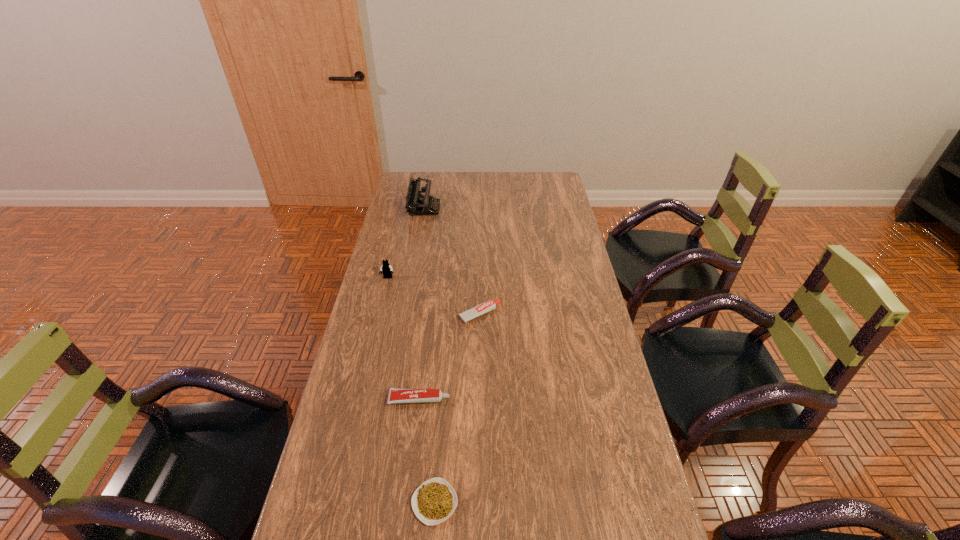
At what (x,y) coordinates should I click in order to perform the action: click on free space located on the typing side of the typewriter. Please return your answer as a coordinate pair (x, y). The image size is (960, 540). Looking at the image, I should click on (467, 209).

I want to click on vacant space located on the front-facing side of the fourth shortest object, so click(x=374, y=335).

At what (x,y) coordinates should I click in order to perform the action: click on vacant space situated at the nozzle of the nearer toothpaste. Please return your answer as a coordinate pair (x, y). Looking at the image, I should click on (572, 399).

Find the location of a particular element. This screenshot has height=540, width=960. vacant area situated on the back of the farther toothpaste is located at coordinates (480, 238).

Where is `free space located on the right of the legume`? free space located on the right of the legume is located at coordinates click(x=610, y=502).

This screenshot has height=540, width=960. I want to click on object that is at the far edge, so click(423, 205).

Where is `typewriter that is positioned at the left edge`? Image resolution: width=960 pixels, height=540 pixels. typewriter that is positioned at the left edge is located at coordinates 423,205.

Locate an element on the screen. This screenshot has width=960, height=540. Lego located at the left edge is located at coordinates (386, 268).

The height and width of the screenshot is (540, 960). Find the location of `toothpaste that is positioned at the left edge`. toothpaste that is positioned at the left edge is located at coordinates tap(396, 395).

Locate an element on the screen. object that is at the far left corner is located at coordinates (423, 205).